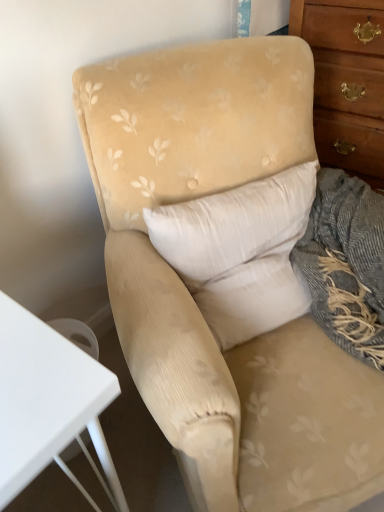
Question: Is wooden chest of drawers at right in front of or behind beige fabric pillow at center in the image?

Choices:
 (A) front
 (B) behind

Answer: (B)

Question: Is wooden chest of drawers at right wider or thinner than beige fabric pillow at center?

Choices:
 (A) wide
 (B) thin

Answer: (A)

Question: From the image's perspective, is wooden chest of drawers at right above or below beige fabric pillow at center?

Choices:
 (A) above
 (B) below

Answer: (A)

Question: Visually, is beige fabric pillow at center positioned to the left or to the right of wooden chest of drawers at right?

Choices:
 (A) left
 (B) right

Answer: (A)

Question: Relative to wooden chest of drawers at right, is beige fabric pillow at center in front or behind?

Choices:
 (A) behind
 (B) front

Answer: (B)

Question: Considering the positions of beige fabric pillow at center and wooden chest of drawers at right in the image, is beige fabric pillow at center wider or thinner than wooden chest of drawers at right?

Choices:
 (A) wide
 (B) thin

Answer: (B)

Question: Is beige fabric pillow at center bigger or smaller than wooden chest of drawers at right?

Choices:
 (A) small
 (B) big

Answer: (A)